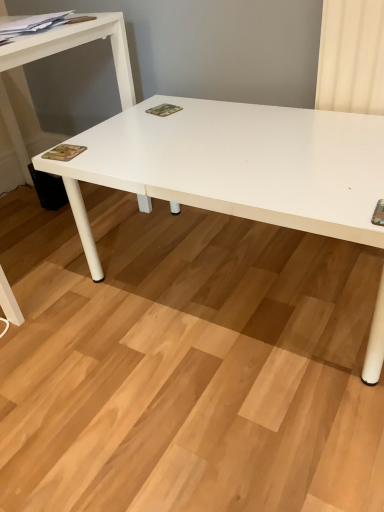
Find the location of a particular element. This screenshot has width=384, height=512. free location to the right of white matte table at left is located at coordinates (202, 269).